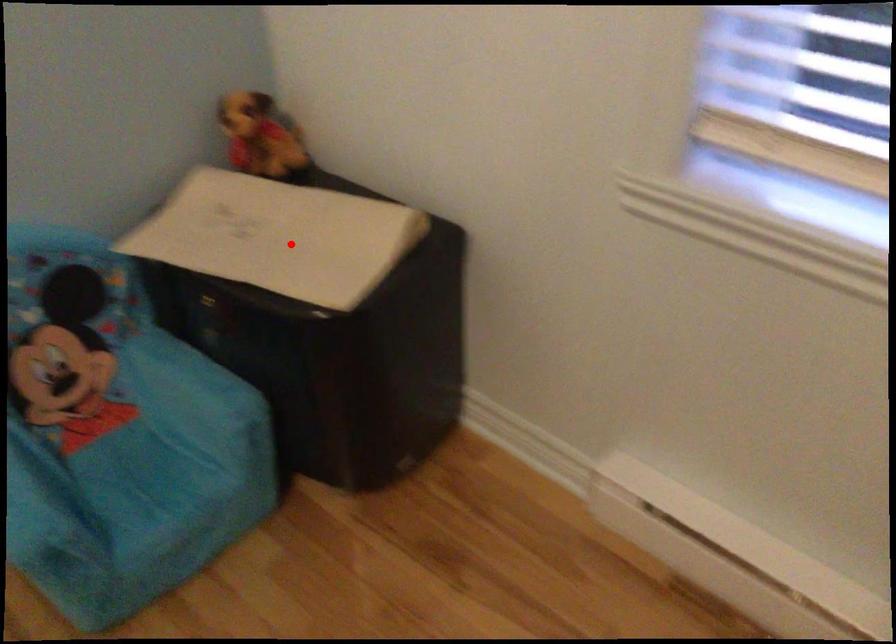
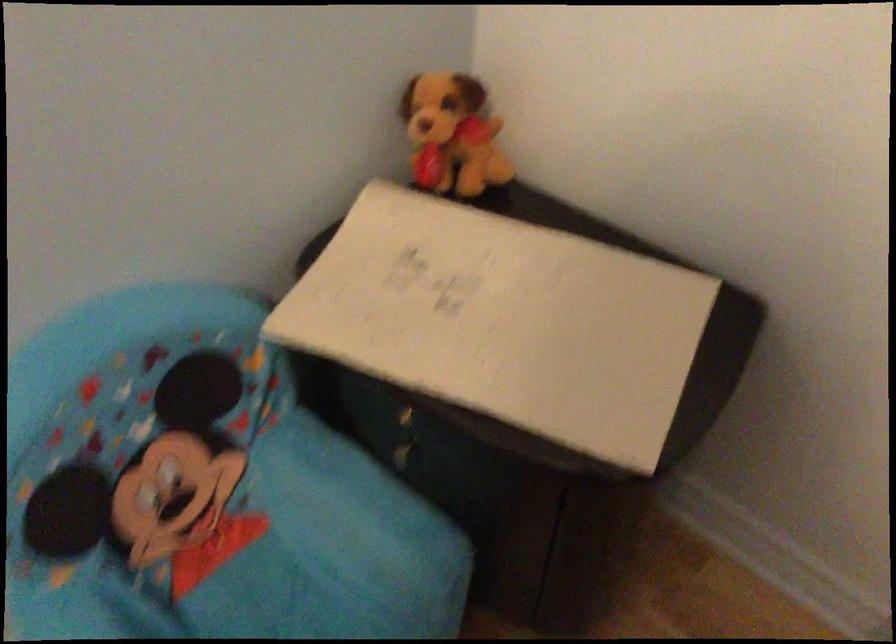
Question: I am providing you with two images of the same scene from different viewpoints. Image1 has a red point marked. In image2, the corresponding 3D location appears at what relative position? Reply with the corresponding letter.

Choices:
 (A) Closer
 (B) Farther

Answer: (A)